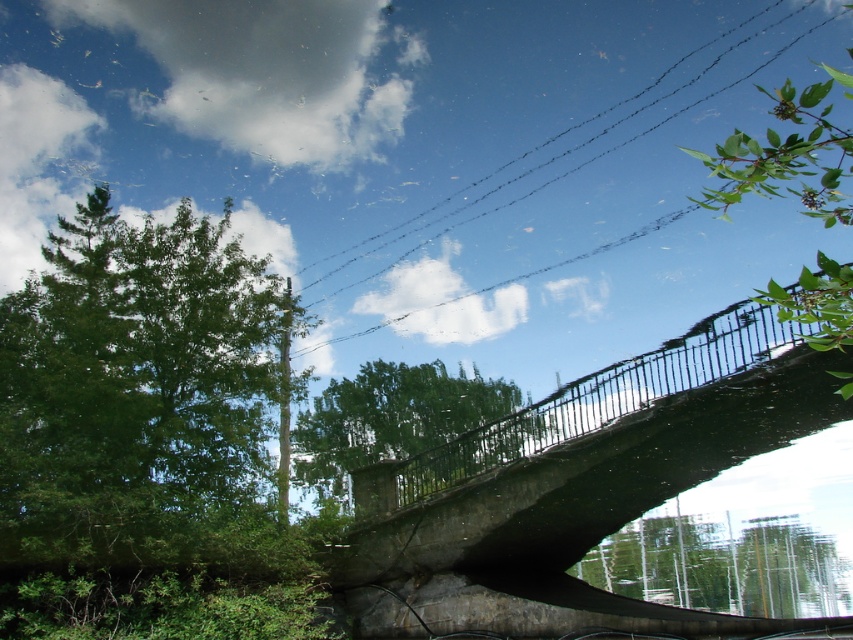
Can you confirm if green leafy tree at center is positioned to the right of black wire at upper center?

Incorrect, green leafy tree at center is not on the right side of black wire at upper center.

Between point (347, 429) and point (753, 68), which one is positioned in front?

Point (753, 68) is in front.

Where is `green leafy tree at center`? green leafy tree at center is located at coordinates (389, 420).

Is green leafy tree at left bigger than black wire at upper center?

Indeed, green leafy tree at left has a larger size compared to black wire at upper center.

Does green leafy tree at left come behind black wire at upper center?

No, it is in front of black wire at upper center.

Which is in front, point (93, 378) or point (630, 113)?

Point (93, 378)

Locate an element on the screen. This screenshot has width=853, height=640. green leafy tree at left is located at coordinates (137, 396).

How far apart are green leafy tree at left and green leafy tree at upper right?

They are 41.58 feet apart.

This screenshot has height=640, width=853. I want to click on green leafy tree at left, so click(x=137, y=396).